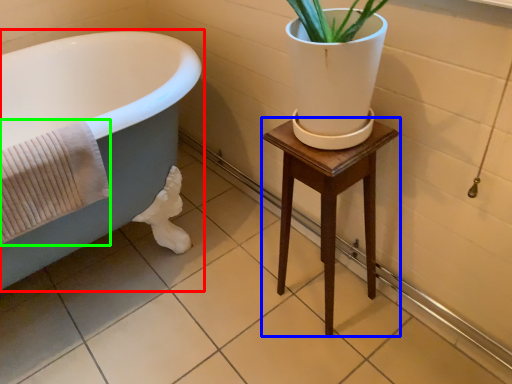
Question: Which is nearer to the bathtub (highlighted by a red box)? furniture (highlighted by a blue box) or bath towel (highlighted by a green box).

Choices:
 (A) furniture
 (B) bath towel

Answer: (B)